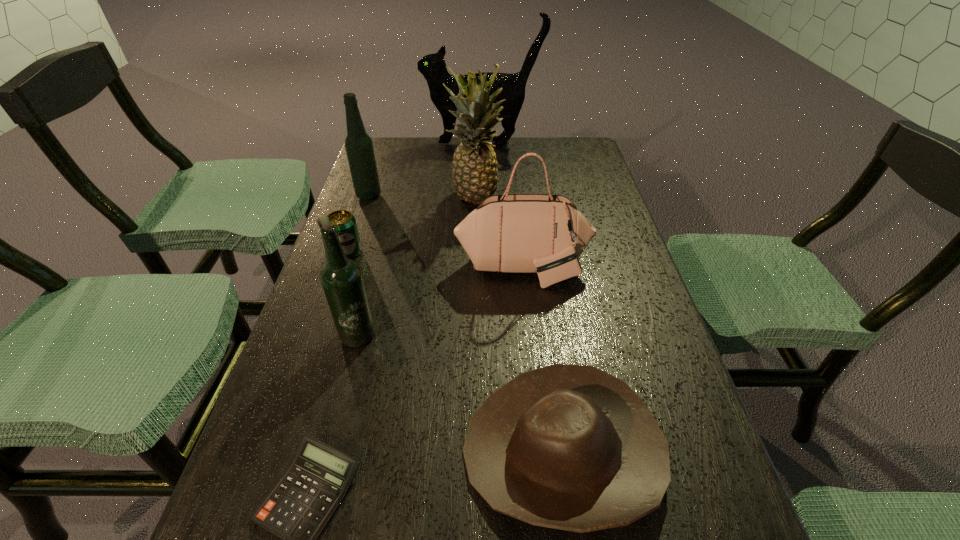
Where is `cat`? cat is located at coordinates (433, 67).

This screenshot has width=960, height=540. I want to click on pineapple, so point(475,175).

Where is `alcohol`? This screenshot has height=540, width=960. alcohol is located at coordinates (359, 148).

You are a GUI agent. You are given a task and a screenshot of the screen. Output one action in this format:
    pyautogui.click(x=<x>, y=<y>)
    Task: Click on the handbag
    
    Given the screenshot: What is the action you would take?
    pyautogui.click(x=545, y=234)

You are a GUI agent. You are given a task and a screenshot of the screen. Output one action in this format:
    pyautogui.click(x=<x>, y=<y>)
    Task: Click on the beer bottle
    
    Given the screenshot: What is the action you would take?
    pyautogui.click(x=341, y=278)

The width and height of the screenshot is (960, 540). I want to click on beer can, so click(345, 223).

This screenshot has width=960, height=540. Find the location of `free spot located on the face of the cat`. free spot located on the face of the cat is located at coordinates (387, 144).

Locate an element on the screen. This screenshot has width=960, height=540. free location located on the face of the cat is located at coordinates (393, 144).

You are a GUI agent. You are given a task and a screenshot of the screen. Output one action in this format:
    pyautogui.click(x=<x>, y=<y>)
    Task: Click on the free spot located 0.080m on the face of the cat
    The width and height of the screenshot is (960, 540).
    Given the screenshot: What is the action you would take?
    pyautogui.click(x=401, y=144)

Find the location of a particular element. This screenshot has width=960, height=540. vacant space located 0.280m on the front of the pineapple is located at coordinates (474, 282).